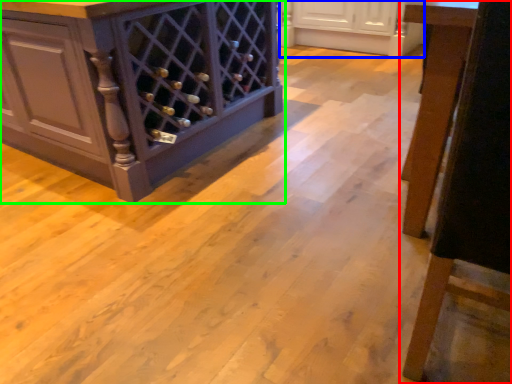
Question: Which object is positioned closest to furniture (highlighted by a red box)? Select from cabinetry (highlighted by a blue box) and cabinetry (highlighted by a green box).

Choices:
 (A) cabinetry
 (B) cabinetry

Answer: (B)